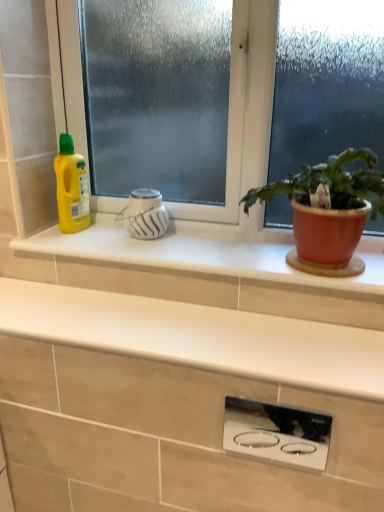
This screenshot has height=512, width=384. Identify the location of free location to the left of matte terracotta pot at right. (193, 251).